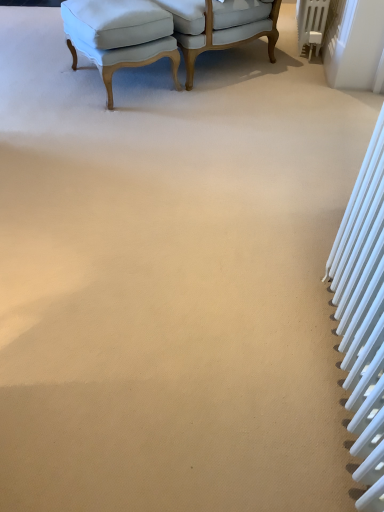
Question: Is white metallic radiator at upper right, marked as the 1th radiator in a top-to-bottom arrangement, outside of light blue fabric chair at upper center, which is counted as the 1th chair, starting from the right?

Choices:
 (A) no
 (B) yes

Answer: (B)

Question: Is white metallic radiator at upper right, which appears as the 1th radiator when viewed from the right, aimed at light blue fabric chair at upper center, which is counted as the 1th chair, starting from the right?

Choices:
 (A) no
 (B) yes

Answer: (B)

Question: Can you confirm if white metallic radiator at upper right, which appears as the 1th radiator when viewed from the right, is thinner than light blue fabric chair at upper center, which is counted as the 1th chair, starting from the right?

Choices:
 (A) no
 (B) yes

Answer: (B)

Question: Is white metallic radiator at upper right, arranged as the second radiator when viewed from the front, in front of light blue fabric chair at upper center, which is counted as the 1th chair, starting from the right?

Choices:
 (A) no
 (B) yes

Answer: (A)

Question: Is white metallic radiator at upper right, the 2th radiator in the bottom-to-top sequence, facing away from light blue fabric chair at upper center, the second chair from the left?

Choices:
 (A) yes
 (B) no

Answer: (B)

Question: In the image, is light blue fabric ottoman at upper left, acting as the second chair starting from the right, on the left side or the right side of white metallic radiator at upper right, which appears as the 1th radiator when viewed from the right?

Choices:
 (A) left
 (B) right

Answer: (A)

Question: From the image's perspective, relative to white metallic radiator at upper right, marked as the 1th radiator in a top-to-bottom arrangement, is light blue fabric ottoman at upper left, acting as the second chair starting from the right, above or below?

Choices:
 (A) above
 (B) below

Answer: (B)

Question: In terms of height, does light blue fabric ottoman at upper left, acting as the second chair starting from the right, look taller or shorter compared to white metallic radiator at upper right, which appears as the second radiator when viewed from the left?

Choices:
 (A) tall
 (B) short

Answer: (A)

Question: Does point (64, 22) appear closer or farther from the camera than point (306, 3)?

Choices:
 (A) closer
 (B) farther

Answer: (A)

Question: In terms of size, does light blue fabric chair at upper center, the second chair from the left, appear bigger or smaller than light blue fabric ottoman at upper left, the 1th chair positioned from the left?

Choices:
 (A) small
 (B) big

Answer: (B)

Question: Is light blue fabric chair at upper center, the second chair from the left, situated inside light blue fabric ottoman at upper left, acting as the second chair starting from the right, or outside?

Choices:
 (A) inside
 (B) outside

Answer: (B)

Question: Looking at their shapes, would you say light blue fabric chair at upper center, which is counted as the 1th chair, starting from the right, is wider or thinner than light blue fabric ottoman at upper left, acting as the second chair starting from the right?

Choices:
 (A) thin
 (B) wide

Answer: (B)

Question: Is point (221, 32) closer or farther from the camera than point (162, 54)?

Choices:
 (A) farther
 (B) closer

Answer: (A)

Question: Based on their positions, is light blue fabric ottoman at upper left, the 1th chair positioned from the left, located to the left or right of white metallic radiator at right, the first radiator from the bottom?

Choices:
 (A) left
 (B) right

Answer: (A)

Question: From a real-world perspective, relative to white metallic radiator at right, the first radiator from the bottom, is light blue fabric ottoman at upper left, acting as the second chair starting from the right, vertically above or below?

Choices:
 (A) above
 (B) below

Answer: (B)